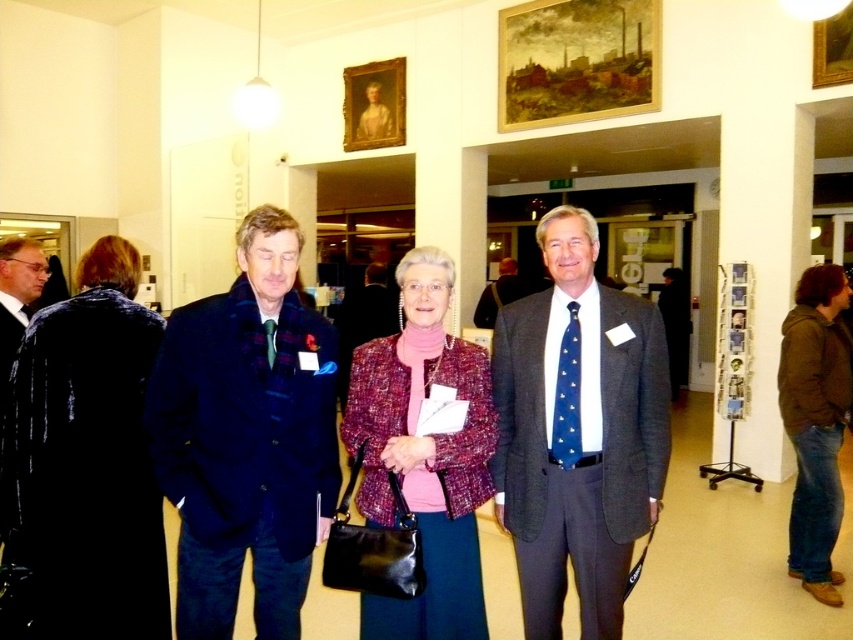
Where is `dark gray suit at center`? This screenshot has height=640, width=853. dark gray suit at center is located at coordinates (577, 432).

Who is shorter, dark gray suit at center or velvet black coat at left?

velvet black coat at left is shorter.

Between point (625, 436) and point (12, 460), which one is positioned in front?

Positioned in front is point (12, 460).

Image resolution: width=853 pixels, height=640 pixels. Identify the location of dark gray suit at center. (577, 432).

Between velvet black coat at left and denim jacket at lower right, which one is positioned higher?

velvet black coat at left is above.

Which is more to the right, velvet black coat at left or denim jacket at lower right?

From the viewer's perspective, denim jacket at lower right appears more on the right side.

Between point (48, 492) and point (828, 502), which one is positioned in front?

Point (48, 492)

Locate an element on the screen. velvet black coat at left is located at coordinates [85, 461].

Who is more distant from viewer, [786,381] or [32,284]?

The point [786,381] is more distant.

Who is more forward, (831, 593) or (1, 376)?

Positioned in front is point (1, 376).

The width and height of the screenshot is (853, 640). I want to click on denim jacket at lower right, so click(x=815, y=422).